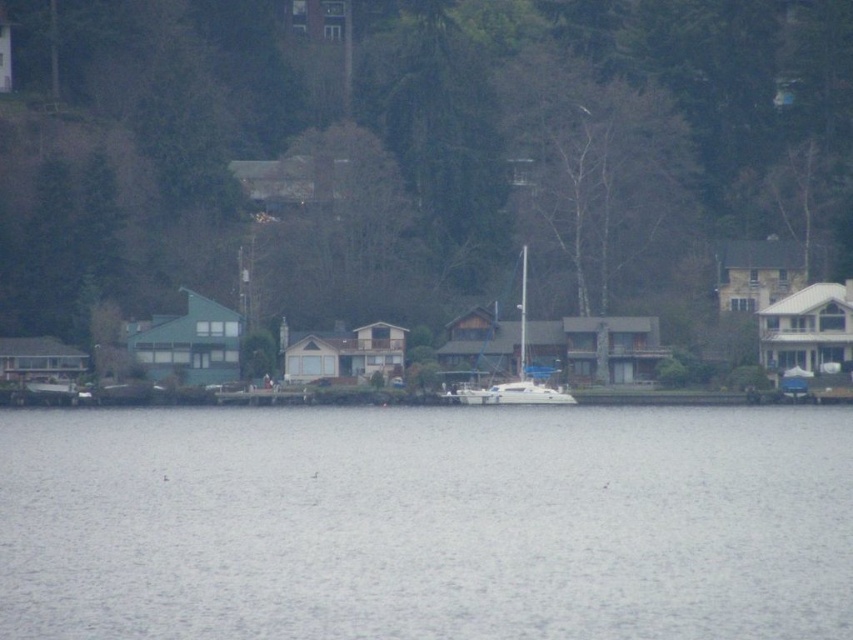
You are standing on the lakeside and see the gray water at center and the white glossy sailboat at center. Which object is closer to the water surface?

The white glossy sailboat at center is closer to the water surface because the gray water at center is located below it.

You are a photographer planning to capture the entire scene of the gray water at center and the white glossy sailboat at center in one shot. Based on their sizes, which object should you focus on first to ensure both are in frame?

The gray water at center is bigger than the white glossy sailboat at center, so you should focus on the gray water at center first to ensure both fit in the frame.

You are a sailor planning to dock your 10 meter long boat at the lakeside. You see the gray water at center and the white glossy sailboat at center. Based on their distance, can your boat fit between them without touching either?

The gray water at center is 31.49 meters from the white glossy sailboat at center. Since your boat is 10 meters long, there is enough space between them to dock without touching either.